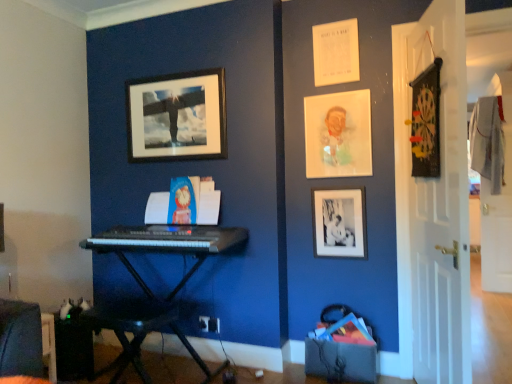
Question: From a real-world perspective, does black matte picture frame at lower right, which is the 1th picture frame from right to left, stand above black matte picture frame at upper center, arranged as the 1th picture frame when viewed from the left?

Choices:
 (A) yes
 (B) no

Answer: (B)

Question: Considering the relative sizes of black matte picture frame at lower right, which is the 1th picture frame from right to left, and black matte picture frame at upper center, the 3th picture frame from the right, in the image provided, is black matte picture frame at lower right, which is the 1th picture frame from right to left, wider than black matte picture frame at upper center, the 3th picture frame from the right,?

Choices:
 (A) yes
 (B) no

Answer: (B)

Question: Does black matte picture frame at lower right, which is the 1th picture frame from right to left, appear on the left side of black matte picture frame at upper center, arranged as the 1th picture frame when viewed from the left?

Choices:
 (A) no
 (B) yes

Answer: (A)

Question: Is black matte picture frame at lower right, which is the 1th picture frame from right to left, not inside black matte picture frame at upper center, the 3th picture frame from the right?

Choices:
 (A) no
 (B) yes

Answer: (B)

Question: Is black matte picture frame at upper center, the 3th picture frame from the right, located within black matte picture frame at lower right, which is the 1th picture frame from right to left?

Choices:
 (A) yes
 (B) no

Answer: (B)

Question: Can you confirm if black matte picture frame at lower right, marked as the 3th picture frame in a left-to-right arrangement, is bigger than black matte picture frame at upper center, arranged as the 1th picture frame when viewed from the left?

Choices:
 (A) yes
 (B) no

Answer: (B)

Question: Does white wood door at right, which is the 1th door from back to front, come behind matte plastic portrait at upper right, the 2th picture frame in the left-to-right sequence?

Choices:
 (A) no
 (B) yes

Answer: (B)

Question: Does white wood door at right, which is the second door from left to right, have a lesser height compared to matte plastic portrait at upper right, marked as the 2th picture frame in a right-to-left arrangement?

Choices:
 (A) no
 (B) yes

Answer: (A)

Question: From the image's perspective, is white wood door at right, which is the second door from left to right, located beneath matte plastic portrait at upper right, marked as the 2th picture frame in a right-to-left arrangement?

Choices:
 (A) yes
 (B) no

Answer: (A)

Question: Is white wood door at right, arranged as the 2th door when viewed from the front, at the left side of matte plastic portrait at upper right, marked as the 2th picture frame in a right-to-left arrangement?

Choices:
 (A) no
 (B) yes

Answer: (A)

Question: Does white wood door at right, arranged as the 2th door when viewed from the front, have a smaller size compared to matte plastic portrait at upper right, marked as the 2th picture frame in a right-to-left arrangement?

Choices:
 (A) yes
 (B) no

Answer: (B)

Question: Is white wood door at right, which is the 1th door from back to front, touching matte plastic portrait at upper right, marked as the 2th picture frame in a right-to-left arrangement?

Choices:
 (A) no
 (B) yes

Answer: (A)

Question: Is the depth of velvet dark blue swivel chair at lower left less than that of black matte picture frame at upper center, the 3th picture frame from the right?

Choices:
 (A) no
 (B) yes

Answer: (B)